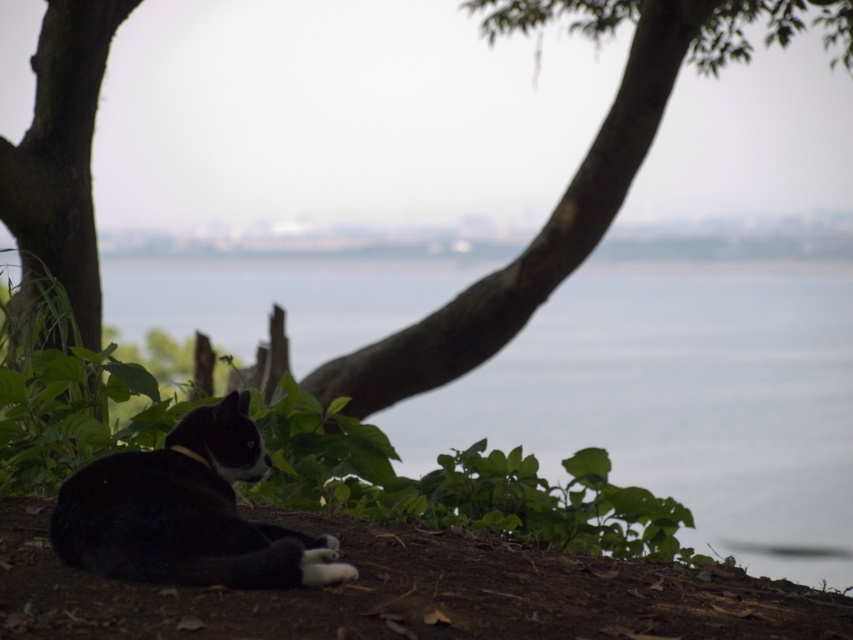
You are a hiker who wants to take a photo of the brown rough tree trunk at center without the transparent water at center blocking the view. Can you move to a position where the tree trunk is fully visible without the water in the frame?

The transparent water at center is taller than the brown rough tree trunk at center, so if you move to a lower position, the water might still block the view. Alternatively, moving to a higher elevation could allow you to see above the water and capture the tree trunk without obstruction.

You are a hiker who wants to cross the transparent water at center to reach the brown rough tree trunk at center. Is the water on the left or right side of the tree trunk?

The transparent water at center is positioned on the left side of brown rough tree trunk at center, so the water is on the left side of the tree trunk.

You are a bird flying over the scene and want to land on a tree trunk. Which tree trunk, the brown rough tree trunk at center or the smooth bark tree trunk at left, is higher up in the scene?

The brown rough tree trunk at center is higher up in the scene than the smooth bark tree trunk at left.